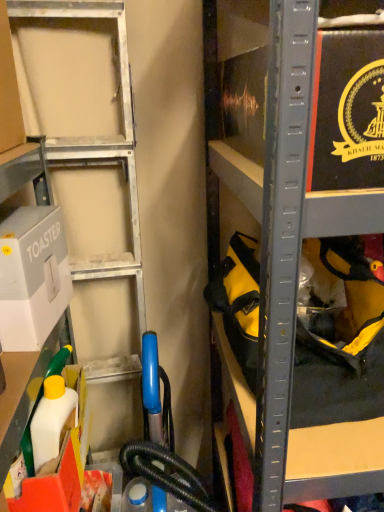
This screenshot has height=512, width=384. What are the coordinates of `free space above white cardboard toaster at left, positioned as the 2th box in bottom-to-top order (from a real-world perspective)` in the screenshot? It's located at (24, 214).